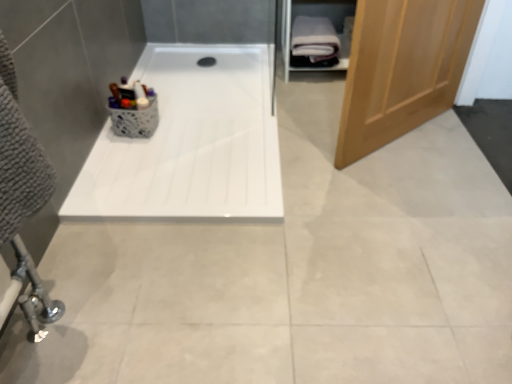
Question: From the image's perspective, is light brown wooden door at right beneath white glossy bathtub at center?

Choices:
 (A) yes
 (B) no

Answer: (B)

Question: From a real-world perspective, is light brown wooden door at right below white glossy bathtub at center?

Choices:
 (A) yes
 (B) no

Answer: (B)

Question: Is light brown wooden door at right positioned with its back to white glossy bathtub at center?

Choices:
 (A) no
 (B) yes

Answer: (B)

Question: Considering the relative positions of light brown wooden door at right and white glossy bathtub at center in the image provided, is light brown wooden door at right in front of white glossy bathtub at center?

Choices:
 (A) yes
 (B) no

Answer: (A)

Question: Would you say light brown wooden door at right is a long distance from white glossy bathtub at center?

Choices:
 (A) yes
 (B) no

Answer: (B)

Question: Does light brown wooden door at right have a greater height compared to white glossy bathtub at center?

Choices:
 (A) yes
 (B) no

Answer: (A)

Question: Is white glossy bathtub at center next to white soft towel at upper right and touching it?

Choices:
 (A) yes
 (B) no

Answer: (B)

Question: Can white soft towel at upper right be found inside white glossy bathtub at center?

Choices:
 (A) no
 (B) yes

Answer: (A)

Question: From the image's perspective, is white glossy bathtub at center beneath white soft towel at upper right?

Choices:
 (A) no
 (B) yes

Answer: (B)

Question: Does white glossy bathtub at center have a lesser height compared to white soft towel at upper right?

Choices:
 (A) no
 (B) yes

Answer: (B)

Question: From a real-world perspective, is white glossy bathtub at center on white soft towel at upper right?

Choices:
 (A) no
 (B) yes

Answer: (A)

Question: Considering the relative sizes of white glossy bathtub at center and white soft towel at upper right in the image provided, is white glossy bathtub at center thinner than white soft towel at upper right?

Choices:
 (A) no
 (B) yes

Answer: (A)

Question: From the image's perspective, is white soft towel at upper right on white glossy bathtub at center?

Choices:
 (A) yes
 (B) no

Answer: (A)